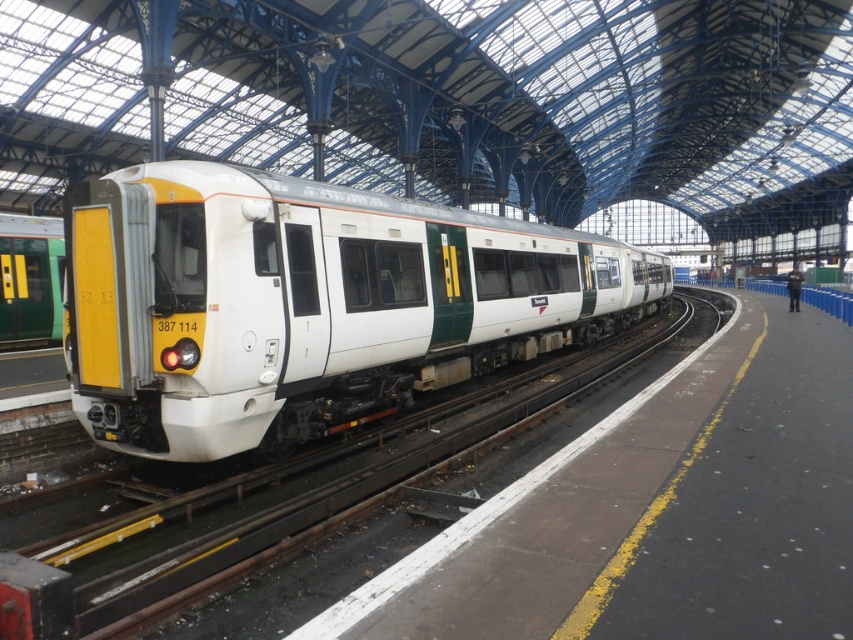
You are standing at the train station platform and see two points marked on the ground. The first point is at coordinates point (202,380) and the second point is at point (602,362). If you were to walk from the first point to the second point, would you be moving towards the train or away from it?

The point (202,380) is in front of point (602,362), so walking from the first point to the second point would mean moving away from the train.

You are a train conductor preparing to load passengers onto the white glossy train at center. The white metal track at center is the only path for the train. Is there a risk that the train might not fit on the track due to its width?

The white glossy train at center might be wider than white metal track at center, so there is a risk that the train might not fit on the track due to its width.